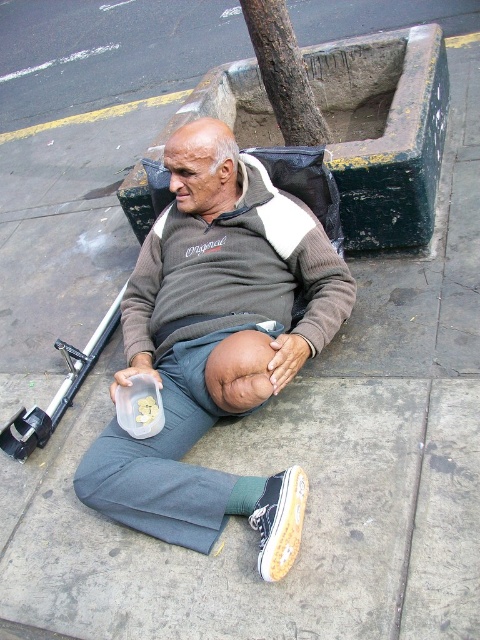
Question: Which of the following is the farthest from the observer?

Choices:
 (A) (219, 413)
 (B) (269, 563)

Answer: (A)

Question: Can you confirm if gray cotton sweater at center is positioned to the left of white canvas shoe at lower center?

Choices:
 (A) no
 (B) yes

Answer: (B)

Question: Which of the following is the farthest from the observer?

Choices:
 (A) (298, 520)
 (B) (157, 333)

Answer: (B)

Question: Can you confirm if gray cotton sweater at center is positioned below white canvas shoe at lower center?

Choices:
 (A) no
 (B) yes

Answer: (A)

Question: Does gray cotton sweater at center have a smaller size compared to white canvas shoe at lower center?

Choices:
 (A) yes
 (B) no

Answer: (B)